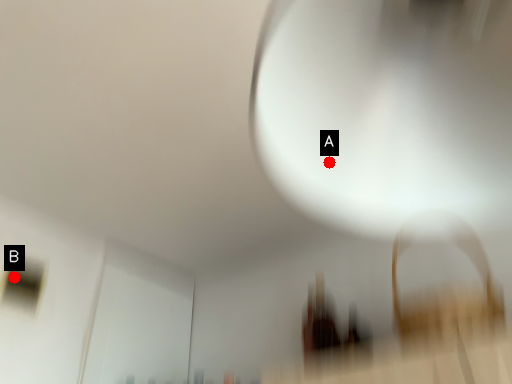
Question: Two points are circled on the image, labeled by A and B beside each circle. Which point is further to the camera?

Choices:
 (A) A is further
 (B) B is further

Answer: (B)